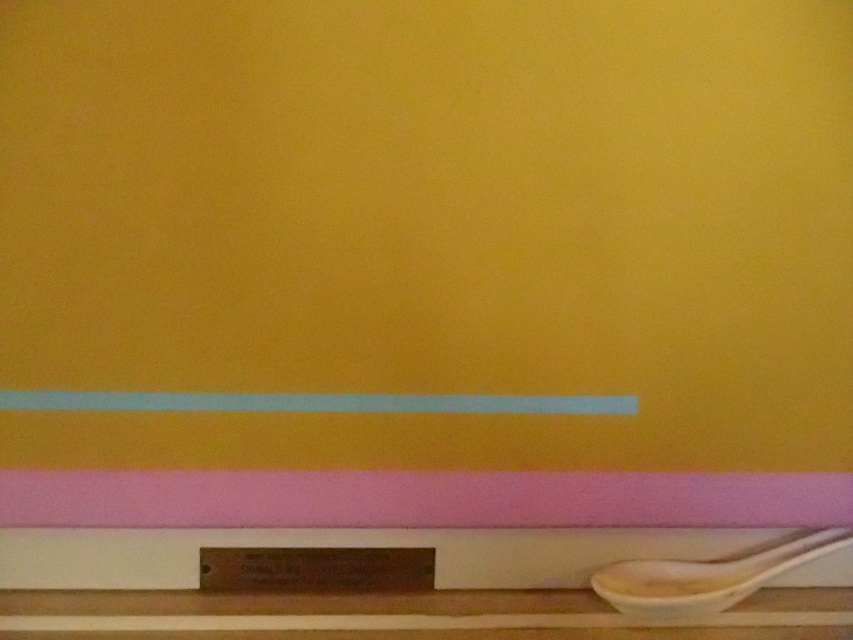
You are arranging items on a shelf and see the white glossy strip at lower center and the white ceramic spoon at lower right. Which item is placed above the other?

The white glossy strip at lower center is positioned over the white ceramic spoon at lower right, meaning it is placed above the spoon.

Based on the photo, you are arranging items on the wooden shelf. You have a white glossy strip at lower center and a white ceramic spoon at lower right. Which item takes up more horizontal space on the shelf?

The white glossy strip at lower center takes up more horizontal space on the shelf because its width is larger than the white ceramic spoon at lower right.

You are organizing items on the wooden shelf and need to place a new item between the white glossy strip at lower center and the white ceramic spoon at lower right. Based on their positions, where should you place the new item?

The white ceramic spoon at lower right is behind the white glossy strip at lower center, so the new item should be placed in front of the white glossy strip at lower center and behind the white ceramic spoon at lower right to maintain their relative positions.